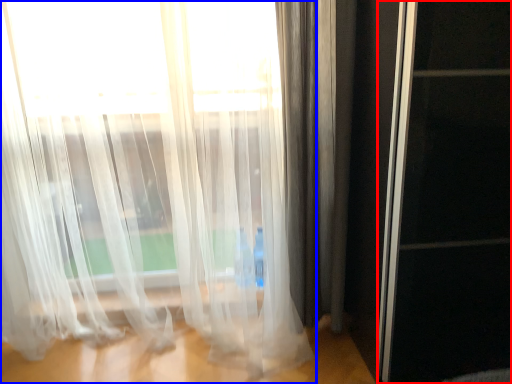
Question: Among these objects, which one is farthest to the camera, screen door (highlighted by a red box) or curtain (highlighted by a blue box)?

Choices:
 (A) screen door
 (B) curtain

Answer: (B)